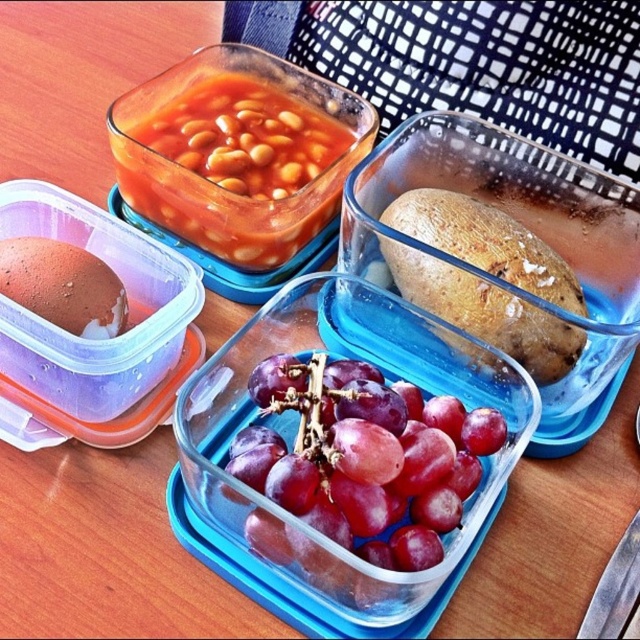
Question: Is shiny purple grapes at center thinner than brown matte egg at left?

Choices:
 (A) yes
 (B) no

Answer: (B)

Question: Does translucent glass beans at upper center appear on the left side of brown matte egg at left?

Choices:
 (A) no
 (B) yes

Answer: (A)

Question: Is translucent glass beans at upper center further to camera compared to brown matte potato at center?

Choices:
 (A) yes
 (B) no

Answer: (A)

Question: Estimate the real-world distances between objects in this image. Which object is farther from the shiny purple grapes at center?

Choices:
 (A) brown matte potato at center
 (B) brown matte egg at left

Answer: (B)

Question: Among these points, which one is nearest to the camera?

Choices:
 (A) (211, 228)
 (B) (68, 307)
 (C) (332, 531)

Answer: (C)

Question: Which object appears closest to the camera in this image?

Choices:
 (A) shiny purple grapes at center
 (B) brown matte potato at center
 (C) brown matte egg at left
 (D) translucent glass beans at upper center

Answer: (A)